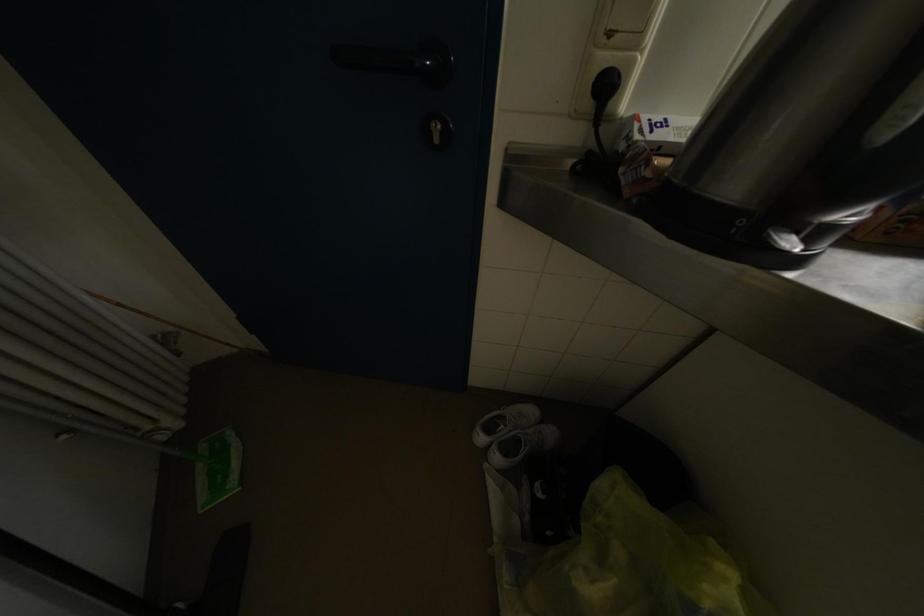
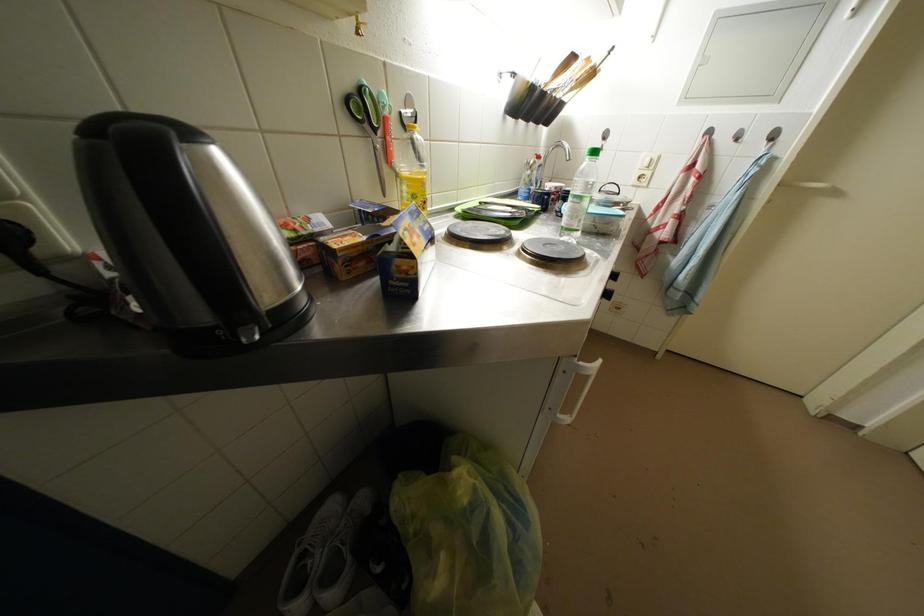
Question: Based on the continuous images, in which direction is the camera rotating? Reply with the corresponding letter.

Choices:
 (A) Left
 (B) Right
 (C) Up
 (D) Down

Answer: (B)